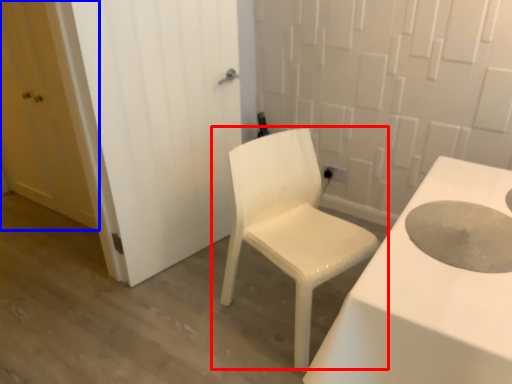
Question: Which object appears farthest to the camera in this image, chair (highlighted by a red box) or door (highlighted by a blue box)?

Choices:
 (A) chair
 (B) door

Answer: (B)